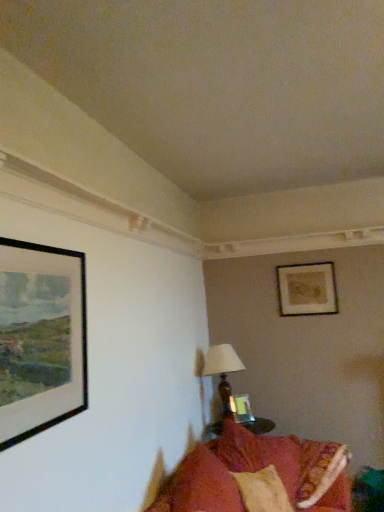
Question: Is matte glass picture frame at center, acting as the 2th picture frame starting from the left, located outside black matte picture frame at left, the first picture frame positioned from the left?

Choices:
 (A) no
 (B) yes

Answer: (B)

Question: From a real-world perspective, does matte glass picture frame at center, which is counted as the 3th picture frame, starting from the top, stand above black matte picture frame at left, the first picture frame positioned from the left?

Choices:
 (A) yes
 (B) no

Answer: (B)

Question: Can you confirm if matte glass picture frame at center, the 2th picture frame in the front-to-back sequence, is taller than black matte picture frame at left, the 3th picture frame viewed from the right?

Choices:
 (A) yes
 (B) no

Answer: (B)

Question: Does matte glass picture frame at center, the 2th picture frame in the front-to-back sequence, turn towards black matte picture frame at left, the first picture frame positioned from the left?

Choices:
 (A) no
 (B) yes

Answer: (A)

Question: Is matte glass picture frame at center, the 2th picture frame in the front-to-back sequence, turned away from black matte picture frame at left, the first picture frame positioned from the left?

Choices:
 (A) no
 (B) yes

Answer: (A)

Question: Looking at their shapes, would you say velvet red couch at lower right is wider or thinner than velvety orange pillow at lower right?

Choices:
 (A) wide
 (B) thin

Answer: (A)

Question: From a real-world perspective, is velvet red couch at lower right physically located above or below velvety orange pillow at lower right?

Choices:
 (A) above
 (B) below

Answer: (A)

Question: Is velvet red couch at lower right in front of or behind velvety orange pillow at lower right in the image?

Choices:
 (A) behind
 (B) front

Answer: (B)

Question: From the image's perspective, relative to velvety orange pillow at lower right, is velvet red couch at lower right above or below?

Choices:
 (A) below
 (B) above

Answer: (B)

Question: Does point (244, 397) appear closer or farther from the camera than point (213, 471)?

Choices:
 (A) closer
 (B) farther

Answer: (B)

Question: In terms of size, does matte glass picture frame at center, marked as the 1th picture frame in a bottom-to-top arrangement, appear bigger or smaller than velvety orange pillow at lower right?

Choices:
 (A) small
 (B) big

Answer: (A)

Question: Is matte glass picture frame at center, acting as the 2th picture frame starting from the left, to the left or to the right of velvety orange pillow at lower right in the image?

Choices:
 (A) left
 (B) right

Answer: (B)

Question: Is matte glass picture frame at center, acting as the 2th picture frame starting from the left, inside the boundaries of velvety orange pillow at lower right, or outside?

Choices:
 (A) outside
 (B) inside

Answer: (A)

Question: Is matte brown table lamp at center bigger or smaller than velvet red couch at lower right?

Choices:
 (A) big
 (B) small

Answer: (B)

Question: From the image's perspective, is matte brown table lamp at center above or below velvet red couch at lower right?

Choices:
 (A) below
 (B) above

Answer: (A)